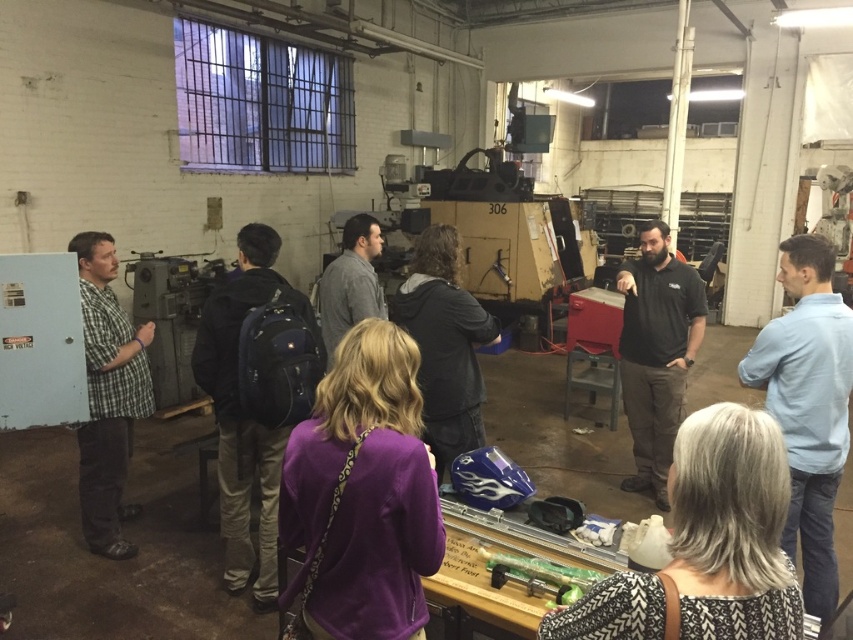
Which is below, gray textured sweater at lower right or black cotton shirt at center?

gray textured sweater at lower right is below.

Locate an element on the screen. The height and width of the screenshot is (640, 853). gray textured sweater at lower right is located at coordinates (730, 528).

The width and height of the screenshot is (853, 640). Find the location of `gray textured sweater at lower right`. gray textured sweater at lower right is located at coordinates (730, 528).

Can you confirm if black backpack at center is thinner than black cotton shirt at center?

No, black backpack at center is not thinner than black cotton shirt at center.

Between point (258, 284) and point (621, 384), which one is positioned behind?

The point (621, 384) is behind.

Which is in front, point (281, 428) or point (686, 314)?

Point (281, 428) is in front.

Where is `black backpack at center`? This screenshot has width=853, height=640. black backpack at center is located at coordinates (248, 412).

Does black cotton shirt at center have a greater height compared to dark gray jacket at center?

Indeed, black cotton shirt at center has a greater height compared to dark gray jacket at center.

Does black cotton shirt at center have a lesser width compared to dark gray jacket at center?

In fact, black cotton shirt at center might be wider than dark gray jacket at center.

Identify the location of black cotton shirt at center. (656, 353).